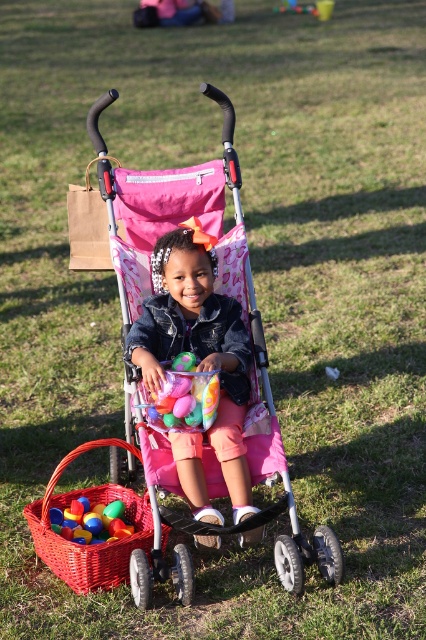
Question: Which of the following is the closest to the observer?

Choices:
 (A) (242, 515)
 (B) (69, 531)

Answer: (A)

Question: Which point is closer to the camera?

Choices:
 (A) translucent plastic eggs at center
 (B) bright red wicker basket at lower left

Answer: (B)

Question: Considering the relative positions of translucent plastic eggs at center and multicolored plastic eggs at center in the image provided, where is translucent plastic eggs at center located with respect to multicolored plastic eggs at center?

Choices:
 (A) above
 (B) below

Answer: (A)

Question: Which point appears farthest from the camera in this image?

Choices:
 (A) (242, 422)
 (B) (161, 385)
 (C) (34, 506)

Answer: (C)

Question: Is pink fabric stroller at center smaller than bright red wicker basket at lower left?

Choices:
 (A) no
 (B) yes

Answer: (A)

Question: Can you confirm if pink fabric stroller at center is wider than multicolored plastic eggs at center?

Choices:
 (A) no
 (B) yes

Answer: (B)